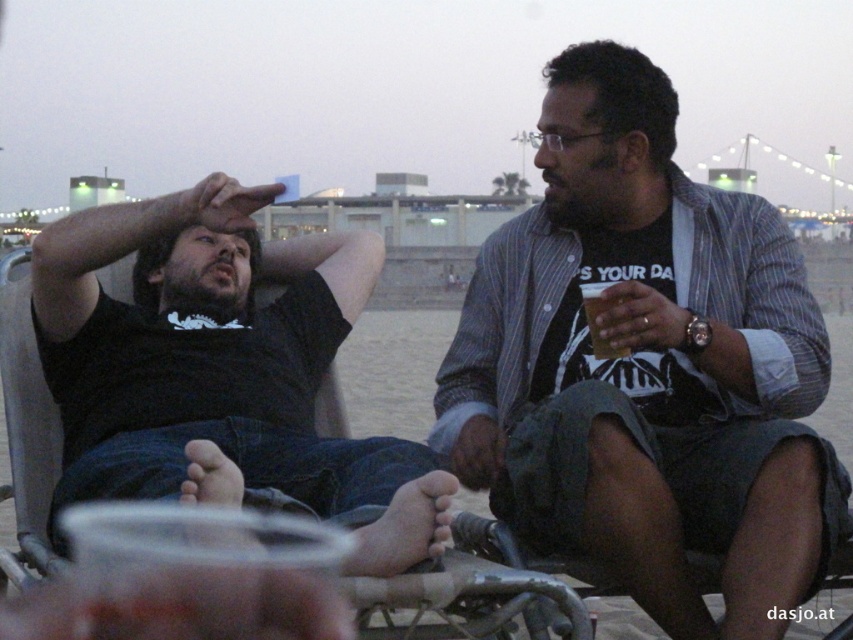
You are a photographer standing at the beach, and you want to take a photo of both the matte black shirt at center and the black matte shirt at left. The minimum distance required between the subjects for your camera to focus properly is 4 feet. Can you capture both subjects in focus without moving them?

The distance between the matte black shirt at center and the black matte shirt at left is 3.59 feet, which is less than the required 4 feet. Therefore, the camera may struggle to keep both subjects in focus without adjusting the settings or moving them closer apart.

You are a photographer trying to capture both the matte black shirt at center and the translucent plastic cup at right in a single frame. Given their sizes, which object will appear larger in your photo?

The matte black shirt at center will appear larger in the photo because it is bigger than the translucent plastic cup at right.

You are trying to decide which shirt to wear for a casual evening out. You have the matte black shirt at center and the black matte shirt at left. Which one has a wider fit?

The matte black shirt at center is wider than the black matte shirt at left, so it has a wider fit.